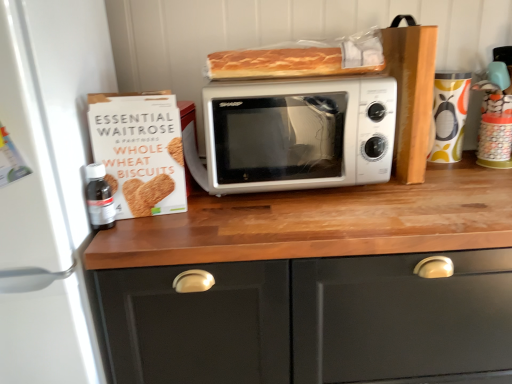
What is the approximate width of transparent plastic bottle at left?

transparent plastic bottle at left is 3.13 inches wide.

What do you see at coordinates (313, 321) in the screenshot? I see `matte wood cabinet at center` at bounding box center [313, 321].

Describe the element at coordinates (301, 59) in the screenshot. I see `golden brown crusty loaf at upper center` at that location.

Image resolution: width=512 pixels, height=384 pixels. What are the coordinates of `white matte microwave at center, marked as the 1th appliance in a left-to-right arrangement` in the screenshot? It's located at (49, 187).

In order to face matte ceramic mug at right, the second appliance in the left-to-right sequence, should I rotate leftwards or rightwards?

Turn right by 24.106 degrees to look at matte ceramic mug at right, the second appliance in the left-to-right sequence.

This screenshot has width=512, height=384. Find the location of `white matte microwave at center`. white matte microwave at center is located at coordinates (295, 134).

Does matte wood cabinet at center have a lesser width compared to matte ceramic mug at right, the second appliance in the left-to-right sequence?

No, matte wood cabinet at center is not thinner than matte ceramic mug at right, the second appliance in the left-to-right sequence.

In order to click on cabinetry that appears below the matte ceramic mug at right, the second appliance in the left-to-right sequence (from a real-world perspective) in this screenshot , I will do `click(313, 321)`.

Based on the photo, is matte wood cabinet at center behind matte ceramic mug at right, positioned as the 1th appliance in right-to-left order?

No, it is not.

Based on the photo, is transparent plastic bottle at left outside of white matte microwave at center?

Absolutely, transparent plastic bottle at left is external to white matte microwave at center.

From the image's perspective, between transparent plastic bottle at left and white matte microwave at center, who is located below?

transparent plastic bottle at left, from the image's perspective.

Does transparent plastic bottle at left appear on the right side of white matte microwave at center?

No.

Based on their sizes in the image, would you say transparent plastic bottle at left is bigger or smaller than white matte microwave at center?

Considering their sizes, transparent plastic bottle at left takes up less space than white matte microwave at center.

From a real-world perspective, is matte wood cabinet at center located higher than white matte microwave at center?

Incorrect, from a real-world perspective, matte wood cabinet at center is lower than white matte microwave at center.

Does point (155, 301) appear closer or farther from the camera than point (282, 93)?

Clearly, point (155, 301) is closer to the camera than point (282, 93).

Is matte wood cabinet at center smaller than white matte microwave at center?

No.

From the image's perspective, who appears lower, matte wood cabinet at center or white matte microwave at center?

matte wood cabinet at center appears lower in the image.

Is white cardboard box at left to the left of matte ceramic mug at right, positioned as the 1th appliance in right-to-left order, from the viewer's perspective?

Yes, white cardboard box at left is to the left of matte ceramic mug at right, positioned as the 1th appliance in right-to-left order.

Is white cardboard box at left spatially inside matte ceramic mug at right, the second appliance in the left-to-right sequence, or outside of it?

white cardboard box at left is located beyond the bounds of matte ceramic mug at right, the second appliance in the left-to-right sequence.

How different are the orientations of white cardboard box at left and matte ceramic mug at right, the second appliance in the left-to-right sequence, in degrees?

The angle between the facing direction of white cardboard box at left and the facing direction of matte ceramic mug at right, the second appliance in the left-to-right sequence, is 6.59 degrees.

Which of these two, white cardboard box at left or matte ceramic mug at right, the second appliance in the left-to-right sequence, is thinner?

Thinner between the two is white cardboard box at left.

In terms of height, does golden brown crusty loaf at upper center look taller or shorter compared to white matte microwave at center?

golden brown crusty loaf at upper center is shorter than white matte microwave at center.

Does golden brown crusty loaf at upper center have a larger size compared to white matte microwave at center?

No, golden brown crusty loaf at upper center is not bigger than white matte microwave at center.

Which object is thinner, golden brown crusty loaf at upper center or white matte microwave at center?

golden brown crusty loaf at upper center.

From the image's perspective, between golden brown crusty loaf at upper center and white matte microwave at center, which one is located above?

golden brown crusty loaf at upper center appears higher in the image.

Which is more to the right, matte wood cabinet at center or transparent plastic bottle at left?

Positioned to the right is matte wood cabinet at center.

Considering the relative sizes of matte wood cabinet at center and transparent plastic bottle at left in the image provided, is matte wood cabinet at center shorter than transparent plastic bottle at left?

No, matte wood cabinet at center is not shorter than transparent plastic bottle at left.

Looking at their sizes, would you say matte wood cabinet at center is wider or thinner than transparent plastic bottle at left?

Clearly, matte wood cabinet at center has more width compared to transparent plastic bottle at left.

Is matte wood cabinet at center positioned beyond the bounds of transparent plastic bottle at left?

That's correct, matte wood cabinet at center is outside of transparent plastic bottle at left.

From a real-world perspective, between golden brown crusty loaf at upper center and white cardboard box at left, who is vertically higher?

golden brown crusty loaf at upper center.

Locate an element on the screen. The image size is (512, 384). cardboard box that appears below the golden brown crusty loaf at upper center (from a real-world perspective) is located at coordinates (140, 151).

Is golden brown crusty loaf at upper center facing away from white cardboard box at left?

No, white cardboard box at left is not at the back of golden brown crusty loaf at upper center.

There is a matte wood cabinet at center. Where is `the 2nd appliance above it (from a real-world perspective)`? the 2nd appliance above it (from a real-world perspective) is located at coordinates (449, 115).

In order to click on bottle that is below the white matte microwave at center (from the image's perspective) in this screenshot , I will do `click(99, 197)`.

From the image, which object appears to be farther from transparent plastic bottle at left, matte wood cabinet at center or white matte microwave at center, marked as the 1th appliance in a left-to-right arrangement?

The object further to transparent plastic bottle at left is matte wood cabinet at center.

When comparing their distances from white matte microwave at center, which is the second appliance from right to left, does transparent plastic bottle at left or golden brown crusty loaf at upper center seem closer?

transparent plastic bottle at left.

Considering their positions, is transparent plastic bottle at left positioned closer to matte wood cabinet at center than golden brown crusty loaf at upper center?

transparent plastic bottle at left is positioned closer to the anchor matte wood cabinet at center.

Which object lies nearer to the anchor point white matte microwave at center, transparent plastic bottle at left or matte ceramic mug at right, the second appliance in the left-to-right sequence?

transparent plastic bottle at left is positioned closer to the anchor white matte microwave at center.

Which object lies nearer to the anchor point white matte microwave at center, which is the second appliance from right to left, golden brown crusty loaf at upper center or white matte microwave at center?

white matte microwave at center is positioned closer to the anchor white matte microwave at center, which is the second appliance from right to left.

Which object lies nearer to the anchor point matte wood cabinet at center, white cardboard box at left or golden brown crusty loaf at upper center?

Among the two, white cardboard box at left is located nearer to matte wood cabinet at center.

From the image, which object appears to be farther from golden brown crusty loaf at upper center, matte wood cabinet at center or white cardboard box at left?

matte wood cabinet at center lies further to golden brown crusty loaf at upper center than the other object.

Which object lies nearer to the anchor point white matte microwave at center, which is the second appliance from right to left, transparent plastic bottle at left or white cardboard box at left?

white cardboard box at left lies closer to white matte microwave at center, which is the second appliance from right to left, than the other object.

Where is `cabinetry situated between white cardboard box at left and matte ceramic mug at right, the second appliance in the left-to-right sequence, from left to right`? The width and height of the screenshot is (512, 384). cabinetry situated between white cardboard box at left and matte ceramic mug at right, the second appliance in the left-to-right sequence, from left to right is located at coordinates (313, 321).

The image size is (512, 384). I want to click on cardboard box between transparent plastic bottle at left and matte ceramic mug at right, the second appliance in the left-to-right sequence, from left to right, so click(x=140, y=151).

Where is `food between white matte microwave at center, marked as the 1th appliance in a left-to-right arrangement, and matte ceramic mug at right, positioned as the 1th appliance in right-to-left order, in the horizontal direction`? The width and height of the screenshot is (512, 384). food between white matte microwave at center, marked as the 1th appliance in a left-to-right arrangement, and matte ceramic mug at right, positioned as the 1th appliance in right-to-left order, in the horizontal direction is located at coordinates (301, 59).

Locate an element on the screen. The height and width of the screenshot is (384, 512). food between white matte microwave at center and matte ceramic mug at right, the second appliance in the left-to-right sequence, from left to right is located at coordinates (301, 59).